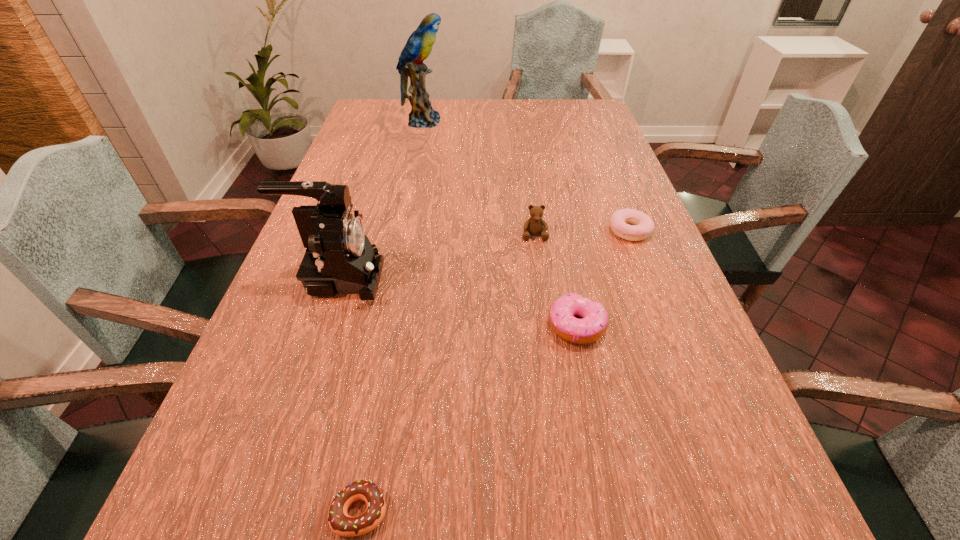
The image size is (960, 540). What are the coordinates of `the tallest object` in the screenshot? It's located at (419, 45).

Locate an element on the screen. parrot is located at coordinates (419, 45).

I want to click on the second tallest object, so click(x=339, y=258).

You are a GUI agent. You are given a task and a screenshot of the screen. Output one action in this format:
    pyautogui.click(x=<x>, y=<y>)
    Task: Click on the teddy bear
    
    Given the screenshot: What is the action you would take?
    pyautogui.click(x=535, y=225)

The width and height of the screenshot is (960, 540). I want to click on the second doughnut from left to right, so click(594, 323).

Where is `the farthest doughnut`? This screenshot has height=540, width=960. the farthest doughnut is located at coordinates (642, 225).

At what (x,y) coordinates should I click in order to perform the action: click on the rightmost doughnut. Please return your answer as a coordinate pair (x, y). The height and width of the screenshot is (540, 960). Looking at the image, I should click on (642, 225).

Locate an element on the screen. This screenshot has width=960, height=540. the leftmost doughnut is located at coordinates (340, 523).

At what (x,y) coordinates should I click in order to perform the action: click on the nearest object. Please return your answer as a coordinate pair (x, y). The width and height of the screenshot is (960, 540). Looking at the image, I should click on (340, 523).

Locate an element on the screen. Image resolution: width=960 pixels, height=540 pixels. free space located on the face of the farthest object is located at coordinates pos(534,122).